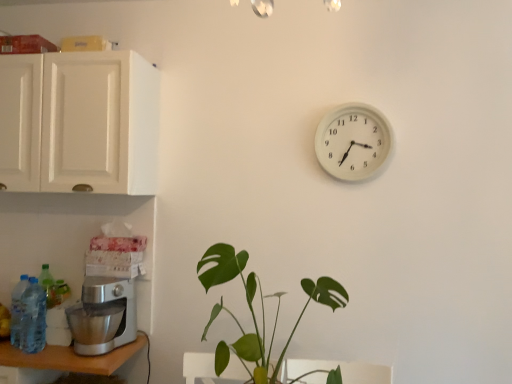
Question: From the image's perspective, is white plastic wall clock at upper right above white matte cabinet at upper left?

Choices:
 (A) yes
 (B) no

Answer: (B)

Question: Is white plastic wall clock at upper right next to white matte cabinet at upper left and touching it?

Choices:
 (A) yes
 (B) no

Answer: (B)

Question: Is white plastic wall clock at upper right aimed at white matte cabinet at upper left?

Choices:
 (A) yes
 (B) no

Answer: (B)

Question: Can you confirm if white plastic wall clock at upper right is thinner than white matte cabinet at upper left?

Choices:
 (A) no
 (B) yes

Answer: (B)

Question: From a real-world perspective, does white plastic wall clock at upper right stand above white matte cabinet at upper left?

Choices:
 (A) no
 (B) yes

Answer: (A)

Question: Considering the relative positions of white plastic wall clock at upper right and white matte cabinet at upper left in the image provided, is white plastic wall clock at upper right to the left of white matte cabinet at upper left from the viewer's perspective?

Choices:
 (A) no
 (B) yes

Answer: (A)

Question: From a real-world perspective, is green matte plant at center below blue plastic bottle at lower left, the 1th bottle viewed from the right?

Choices:
 (A) yes
 (B) no

Answer: (B)

Question: From the image's perspective, is green matte plant at center over blue plastic bottle at lower left, acting as the 2th bottle starting from the left?

Choices:
 (A) no
 (B) yes

Answer: (B)

Question: Considering the relative sizes of green matte plant at center and blue plastic bottle at lower left, acting as the 2th bottle starting from the left, in the image provided, is green matte plant at center wider than blue plastic bottle at lower left, acting as the 2th bottle starting from the left,?

Choices:
 (A) yes
 (B) no

Answer: (A)

Question: Can you confirm if green matte plant at center is smaller than blue plastic bottle at lower left, the 1th bottle viewed from the right?

Choices:
 (A) no
 (B) yes

Answer: (A)

Question: Are green matte plant at center and blue plastic bottle at lower left, the 1th bottle viewed from the right, far apart?

Choices:
 (A) yes
 (B) no

Answer: (B)

Question: Does green matte plant at center have a larger size compared to blue plastic bottle at lower left, the 1th bottle viewed from the right?

Choices:
 (A) yes
 (B) no

Answer: (A)

Question: Is translucent plastic bottle at lower left, the 1th bottle from the left, bigger than silver metallic table at lower left?

Choices:
 (A) no
 (B) yes

Answer: (A)